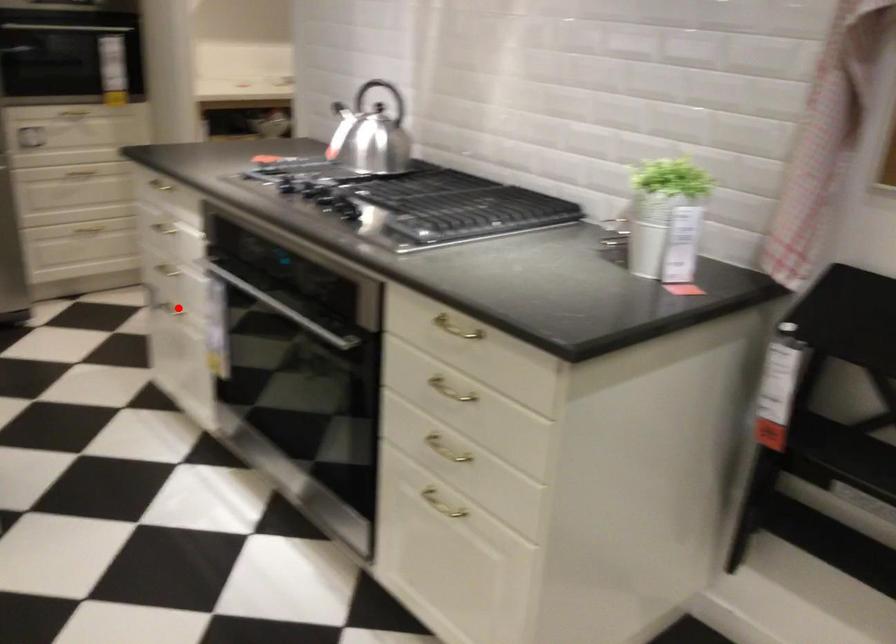
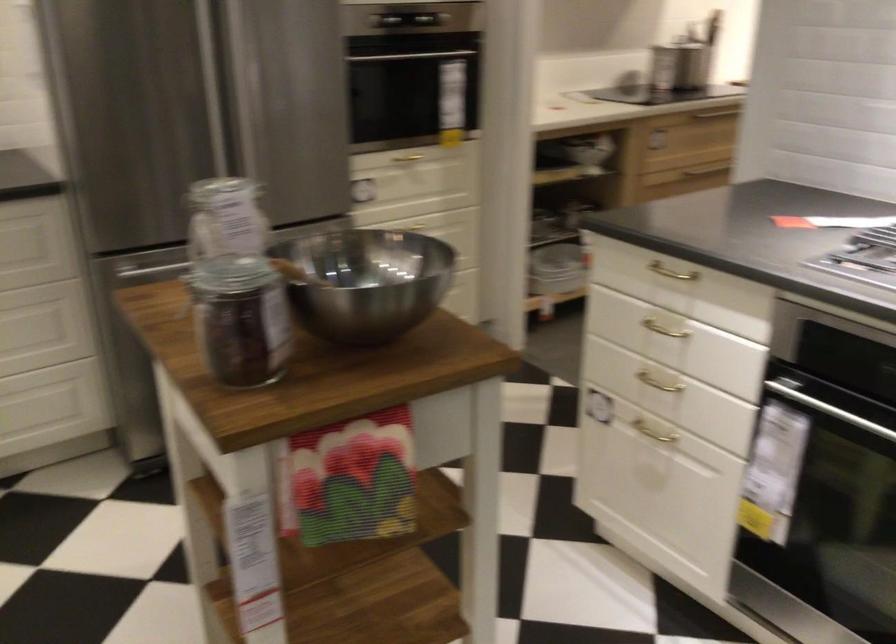
Find the pixel in the second image that matches the highlighted location in the first image.

(655, 431)